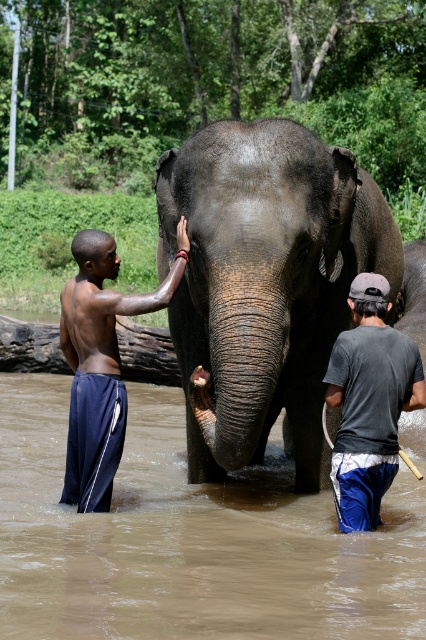
From the picture: You are standing in the natural setting shown. You want to pick up the brown wood log at left to give to the dark gray textured elephant at center. Can you toss the log directly to the elephant without moving closer?

The dark gray textured elephant at center is closer to the viewer than the brown wood log at left, so yes, you can toss the log directly to the elephant without moving closer because the elephant is nearer to you than the log.

You are planning to take a photo of the dark gray textured elephant at center and the dark blue shorts at left. If the elephant is wider than the shorts, how should you position your camera to ensure both are fully in frame?

Since the dark gray textured elephant at center is wider than the dark blue shorts at left, position the camera so that the elephant occupies the majority of the frame width while ensuring the dark blue shorts at left are still visible on the side.